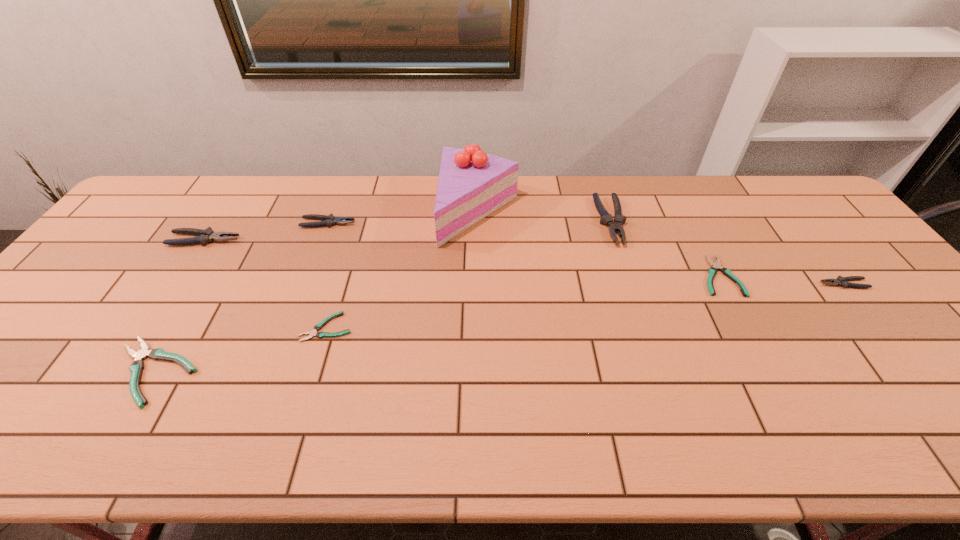
This screenshot has width=960, height=540. I want to click on free location that satisfies the following two spatial constraints: 1. at the gripping part of the third shortest pliers; 2. on the left side of the leftmost gray pliers, so click(x=118, y=372).

Identify the location of free space that satisfies the following two spatial constraints: 1. on the back side of the sixth pliers from left to right; 2. on the right side of the sixth tallest object. (210, 276).

The image size is (960, 540). I want to click on free location that satisfies the following two spatial constraints: 1. at the gripping part of the third pliers from right to left; 2. at the gripping part of the second smallest gray pliers, so click(x=612, y=223).

Identify the location of vacant space that satisfies the following two spatial constraints: 1. at the gripping part of the second tallest pliers; 2. on the back side of the second object from right to left. The height and width of the screenshot is (540, 960). (180, 276).

This screenshot has height=540, width=960. Identify the location of free region that satisfies the following two spatial constraints: 1. at the gripping part of the biggest gray pliers; 2. at the gripping part of the fifth shortest object. (612, 223).

At what (x,y) coordinates should I click in order to perform the action: click on vacant position in the image that satisfies the following two spatial constraints: 1. at the gripping part of the third gray pliers from left to right; 2. at the gripping part of the third biggest gray pliers. Please return your answer as a coordinate pair (x, y). The width and height of the screenshot is (960, 540). Looking at the image, I should click on (612, 223).